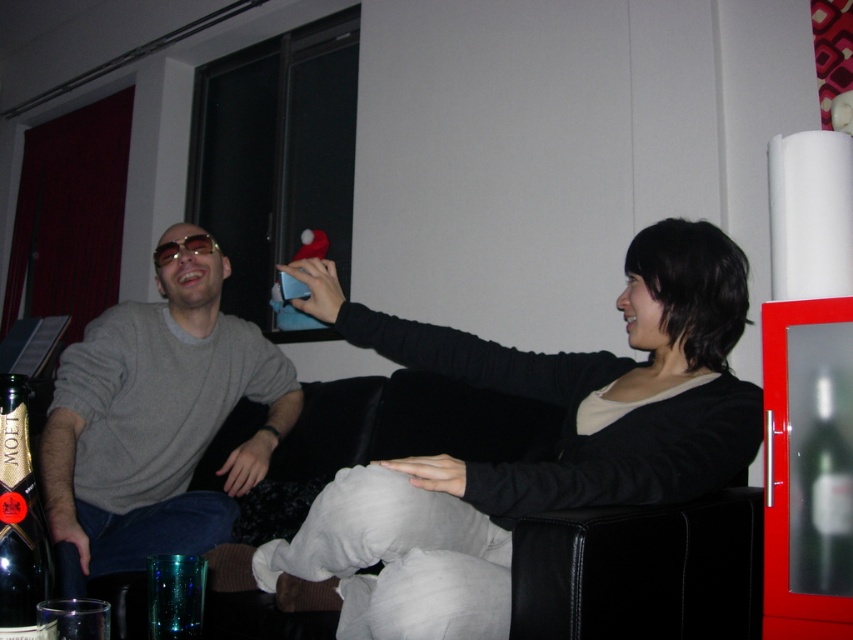
You are an interior designer analyzing the placement of objects in this living room. The matte gray sweater at center is currently located at coordinates 0.653, 0.185. If you want to move it to the exact center of the room, which direction should you move it from its current position?

The exact center of the room would be at coordinates (x=426, y=320). Since the current location of the matte gray sweater at center is at (x=157, y=417), it needs to move to the left and upward to reach the center.

You are a guest at a dinner party and see the dark glass bottle at lower left and the translucent glass cup at lower left on the table. Which one is more to the left?

The dark glass bottle at lower left is more to the left.

You are a delivery person trying to place a small package on the table between the matte gray sweater at center and the dark glass bottle at lower left. Can you fit the package there without moving either object?

The matte gray sweater at center might be wider than dark glass bottle at lower left, so there might not be enough space between them to place the package without moving at least one object.